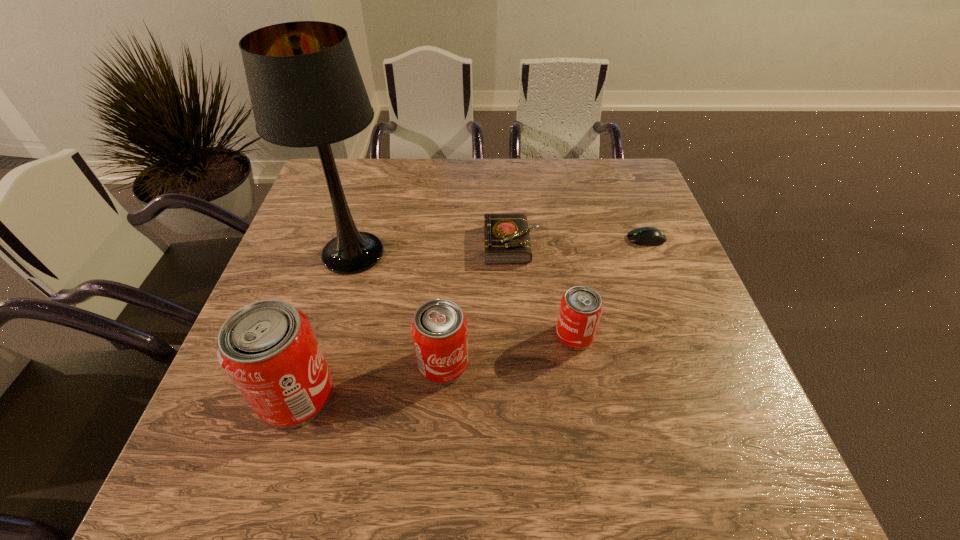
In order to click on object located at the right edge in this screenshot , I will do `click(647, 236)`.

You are a GUI agent. You are given a task and a screenshot of the screen. Output one action in this format:
    pyautogui.click(x=<x>, y=<y>)
    Task: Click on the object that is at the near left corner
    
    Given the screenshot: What is the action you would take?
    pyautogui.click(x=268, y=348)

I want to click on blank space at the far edge, so pos(412,171).

The height and width of the screenshot is (540, 960). I want to click on vacant space at the left edge, so (330, 288).

You are a GUI agent. You are given a task and a screenshot of the screen. Output one action in this format:
    pyautogui.click(x=<x>, y=<y>)
    Task: Click on the free region at the right edge of the desktop
    
    Given the screenshot: What is the action you would take?
    pyautogui.click(x=679, y=380)

Find the location of a particular element. This screenshot has width=960, height=540. blank area at the far left corner is located at coordinates (343, 163).

The height and width of the screenshot is (540, 960). I want to click on vacant area between the shortest object and the shortest can, so click(x=611, y=287).

Where is `free space between the leftmost can and the third tallest object`? This screenshot has height=540, width=960. free space between the leftmost can and the third tallest object is located at coordinates (370, 380).

Find the location of a particular element. This screenshot has width=960, height=540. vacant point located between the table lamp and the fourth object from right to left is located at coordinates (398, 308).

Find the location of a particular element. free space between the tallest object and the second can from left to right is located at coordinates (398, 308).